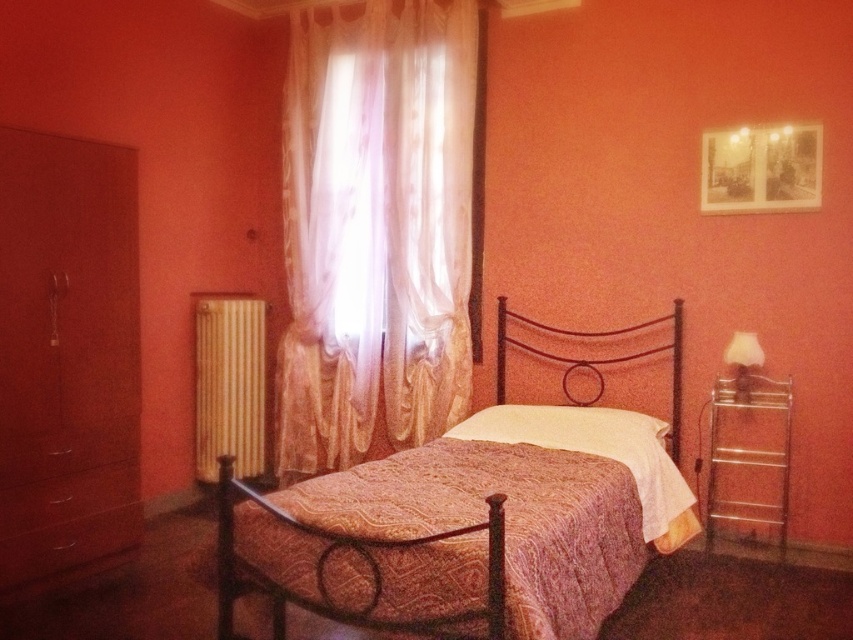
You are organizing a small toy car that is 10 cm long. You want to place it either on the matte brown drawer at lower left or the metallic brown headboard at center. Based on their sizes, which surface can accommodate the toy car without it hanging over the edge?

The metallic brown headboard at center is larger than the matte brown drawer at lower left. Since the toy car is 10 cm long, the metallic brown headboard at center has enough space to accommodate it without hanging over the edge.

You are an interior designer planning to place a new sofa in this bedroom. The sofa is 1.8 meters wide. You need to ensure it fits between the metallic bed at center and the matte wood dresser at left. Can the sofa fit in the space between them?

The metallic bed at center is wider than the matte wood dresser at left. However, the description does not provide the exact distance between them, so it is unclear if the sofa will fit. More information about the space between the two objects is needed to determine this.